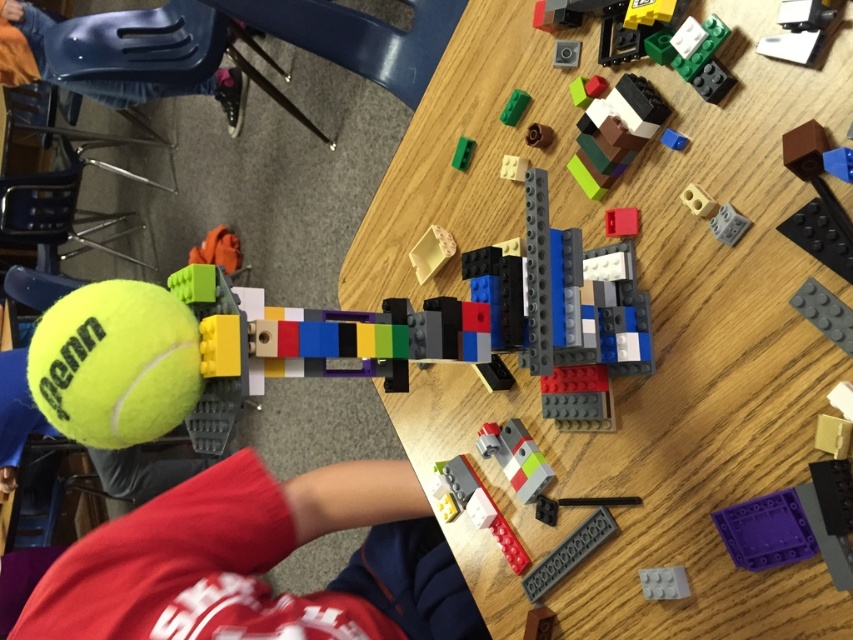
Question: Is rubber matte tennis ball at center smaller than matte plastic brick at center?

Choices:
 (A) no
 (B) yes

Answer: (A)

Question: Which object is closer to the camera taking this photo?

Choices:
 (A) green matte block at upper center
 (B) glossy plastic chair at upper left
 (C) metallic silver stapler at upper right
 (D) wooden table at center

Answer: (C)

Question: Which object is farther from the camera taking this photo?

Choices:
 (A) gray matte brick at lower right
 (B) green plastic brick at upper center
 (C) blue plastic chair at upper left
 (D) yellow matte tennis ball at lower left

Answer: (C)

Question: Observing the image, what is the correct spatial positioning of glossy plastic chair at upper left in reference to purple plastic plate at center?

Choices:
 (A) right
 (B) left

Answer: (B)

Question: Which point is closer to the camera?

Choices:
 (A) (450, 234)
 (B) (720, 520)

Answer: (B)

Question: Considering the relative positions of wooden table at center and green plastic brick at upper center in the image provided, where is wooden table at center located with respect to green plastic brick at upper center?

Choices:
 (A) right
 (B) left

Answer: (A)